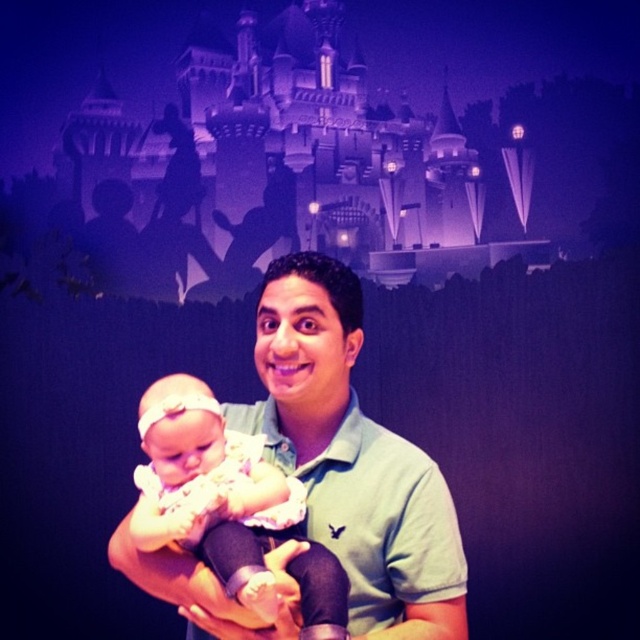
Does point (456, 225) come closer to viewer compared to point (198, 445)?

That is False.

Based on the photo, does purple stone castle at upper center appear on the left side of soft pink fabric baby at center?

No, purple stone castle at upper center is not to the left of soft pink fabric baby at center.

Between point (476, 260) and point (218, 429), which one is positioned in front?

Point (218, 429)

This screenshot has height=640, width=640. What are the coordinates of `purple stone castle at upper center` in the screenshot? It's located at (275, 168).

Is purple stone castle at upper center to the right of green cotton shirt at center from the viewer's perspective?

Incorrect, purple stone castle at upper center is not on the right side of green cotton shirt at center.

Is point (403, 188) farther from camera compared to point (387, 467)?

Yes, point (403, 188) is farther from viewer.

Find the location of a particular element. Image resolution: width=640 pixels, height=640 pixels. purple stone castle at upper center is located at coordinates [x=275, y=168].

Is point (300, 470) positioned in front of point (156, 509)?

No, it is behind (156, 509).

Is green cotton shirt at center wider than soft pink fabric baby at center?

Indeed, green cotton shirt at center has a greater width compared to soft pink fabric baby at center.

Measure the distance between green cotton shirt at center and camera.

A distance of 60.36 meters exists between green cotton shirt at center and camera.

Image resolution: width=640 pixels, height=640 pixels. I want to click on green cotton shirt at center, so click(x=353, y=458).